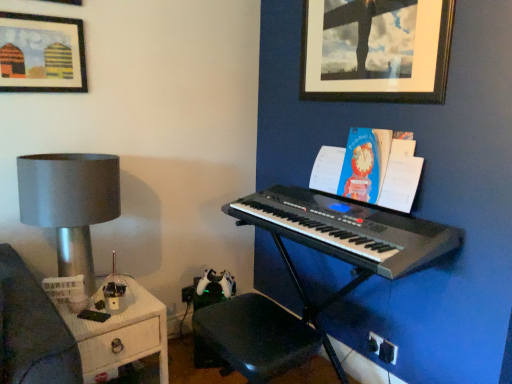
Locate an element on the screen. The width and height of the screenshot is (512, 384). blue paper book at upper right is located at coordinates (370, 169).

The height and width of the screenshot is (384, 512). What do you see at coordinates (370, 169) in the screenshot?
I see `blue paper book at upper right` at bounding box center [370, 169].

Describe the element at coordinates (376, 50) in the screenshot. Image resolution: width=512 pixels, height=384 pixels. I see `black matte picture frame at upper right, the 2th picture frame positioned from the left` at that location.

The height and width of the screenshot is (384, 512). Describe the element at coordinates (120, 332) in the screenshot. I see `white wood side table at lower left` at that location.

Measure the distance between matte silver lamp at left and camera.

A distance of 1.50 meters exists between matte silver lamp at left and camera.

Where is `matte silver lamp at left`? matte silver lamp at left is located at coordinates (70, 203).

Describe the element at coordinates (41, 54) in the screenshot. I see `matte wood picture frame at upper left, which ranks as the first picture frame in left-to-right order` at that location.

The width and height of the screenshot is (512, 384). What are the coordinates of `blue paper book at upper right` in the screenshot? It's located at (370, 169).

Does black plastic music stool at lower center appear on the right side of matte silver lamp at left?

Yes, black plastic music stool at lower center is to the right of matte silver lamp at left.

How distant is black plastic music stool at lower center from matte silver lamp at left?

26.82 inches.

From the image's perspective, which object appears higher, black plastic music stool at lower center or matte silver lamp at left?

matte silver lamp at left.

Choose the correct answer: Is matte wood picture frame at upper left, arranged as the 2th picture frame when viewed from the right, inside blue paper book at upper right or outside it?

matte wood picture frame at upper left, arranged as the 2th picture frame when viewed from the right, exists outside the volume of blue paper book at upper right.

In the scene shown: Which of these two, matte wood picture frame at upper left, arranged as the 2th picture frame when viewed from the right, or blue paper book at upper right, stands shorter?

With less height is matte wood picture frame at upper left, arranged as the 2th picture frame when viewed from the right.

Is matte wood picture frame at upper left, which ranks as the first picture frame in left-to-right order, not near blue paper book at upper right?

Yes, matte wood picture frame at upper left, which ranks as the first picture frame in left-to-right order, and blue paper book at upper right are located far from each other.

Can you confirm if matte wood picture frame at upper left, which ranks as the first picture frame in left-to-right order, is smaller than blue paper book at upper right?

Yes, matte wood picture frame at upper left, which ranks as the first picture frame in left-to-right order, is smaller than blue paper book at upper right.

Which of these two, white wood side table at lower left or blue paper book at upper right, stands taller?

white wood side table at lower left.

Does white wood side table at lower left have a larger size compared to blue paper book at upper right?

Indeed, white wood side table at lower left has a larger size compared to blue paper book at upper right.

Which point is more distant from viewer, [137,314] or [411,162]?

The point [411,162] is farther.

Is white wood side table at lower left inside or outside of blue paper book at upper right?

white wood side table at lower left is located beyond the bounds of blue paper book at upper right.

Is black plastic keyboard at center completely or partially inside black plastic music stool at lower center?

That's incorrect, black plastic keyboard at center is not inside black plastic music stool at lower center.

Between point (210, 325) and point (346, 237), which one is positioned behind?

Positioned behind is point (210, 325).

Consider the image. From a real-world perspective, is black plastic music stool at lower center above or below black plastic keyboard at center?

black plastic music stool at lower center is situated lower than black plastic keyboard at center in the real world.

From the picture: From the image's perspective, relative to black plastic keyboard at center, is white wood side table at lower left above or below?

Clearly, from the image's perspective, white wood side table at lower left is below black plastic keyboard at center.

Can you confirm if white wood side table at lower left is positioned to the left of black plastic keyboard at center?

Yes.

Does point (87, 372) come behind point (308, 297)?

That is False.

Are black plastic keyboard at center and white wood side table at lower left beside each other?

They are not placed beside each other.

Considering the relative positions of black plastic keyboard at center and white wood side table at lower left in the image provided, is black plastic keyboard at center to the left of white wood side table at lower left from the viewer's perspective?

In fact, black plastic keyboard at center is to the right of white wood side table at lower left.

From the image's perspective, relative to white wood side table at lower left, is black plastic keyboard at center above or below?

Clearly, from the image's perspective, black plastic keyboard at center is above white wood side table at lower left.

Is blue paper book at upper right positioned with its back to black plastic music stool at lower center?

No, blue paper book at upper right is not facing the opposite direction of black plastic music stool at lower center.

Is blue paper book at upper right placed right next to black plastic music stool at lower center?

No, blue paper book at upper right is not touching black plastic music stool at lower center.

Which of these two, blue paper book at upper right or black plastic music stool at lower center, is bigger?

black plastic music stool at lower center.

From the image's perspective, is blue paper book at upper right located above or below black plastic music stool at lower center?

Based on their image positions, blue paper book at upper right is located above black plastic music stool at lower center.

At what (x,y) coordinates should I click in order to perform the action: click on music stool on the right of matte silver lamp at left. Please return your answer as a coordinate pair (x, y). This screenshot has width=512, height=384. Looking at the image, I should click on [256, 336].

Find the location of a particular element. This screenshot has height=384, width=512. book that appears below the matte wood picture frame at upper left, arranged as the 2th picture frame when viewed from the right (from a real-world perspective) is located at coordinates (370, 169).

Which object lies nearer to the anchor point black plastic music stool at lower center, black plastic keyboard at center or matte wood picture frame at upper left, arranged as the 2th picture frame when viewed from the right?

black plastic keyboard at center is positioned closer to the anchor black plastic music stool at lower center.

Looking at the image, which one is located further to black plastic music stool at lower center, matte wood picture frame at upper left, arranged as the 2th picture frame when viewed from the right, or black plastic keyboard at center?

matte wood picture frame at upper left, arranged as the 2th picture frame when viewed from the right, lies further to black plastic music stool at lower center than the other object.

From the image, which object appears to be farther from blue paper book at upper right, white wood side table at lower left or black plastic music stool at lower center?

The object further to blue paper book at upper right is white wood side table at lower left.

Based on their spatial positions, is matte silver lamp at left or black matte picture frame at upper right, positioned as the 1th picture frame in right-to-left order, closer to blue paper book at upper right?

black matte picture frame at upper right, positioned as the 1th picture frame in right-to-left order.

Based on their spatial positions, is black plastic keyboard at center or black matte picture frame at upper right, positioned as the 1th picture frame in right-to-left order, further from matte wood picture frame at upper left, arranged as the 2th picture frame when viewed from the right?

Among the two, black matte picture frame at upper right, positioned as the 1th picture frame in right-to-left order, is located further to matte wood picture frame at upper left, arranged as the 2th picture frame when viewed from the right.

Looking at the image, which one is located closer to blue paper book at upper right, matte silver lamp at left or matte wood picture frame at upper left, which ranks as the first picture frame in left-to-right order?

The object closer to blue paper book at upper right is matte silver lamp at left.

Which object lies nearer to the anchor point black matte picture frame at upper right, positioned as the 1th picture frame in right-to-left order, matte wood picture frame at upper left, arranged as the 2th picture frame when viewed from the right, or black plastic keyboard at center?

The object closer to black matte picture frame at upper right, positioned as the 1th picture frame in right-to-left order, is black plastic keyboard at center.

Considering their positions, is white wood side table at lower left positioned further to black plastic keyboard at center than matte wood picture frame at upper left, arranged as the 2th picture frame when viewed from the right?

Based on the image, matte wood picture frame at upper left, arranged as the 2th picture frame when viewed from the right, appears to be further to black plastic keyboard at center.

This screenshot has height=384, width=512. What are the coordinates of `music stool between white wood side table at lower left and black plastic keyboard at center in the horizontal direction` in the screenshot? It's located at (256, 336).

This screenshot has height=384, width=512. I want to click on picture frame between black matte picture frame at upper right, the 2th picture frame positioned from the left, and black plastic music stool at lower center in the up-down direction, so click(x=41, y=54).

The width and height of the screenshot is (512, 384). What are the coordinates of `musical keyboard between matte wood picture frame at upper left, arranged as the 2th picture frame when viewed from the right, and black matte picture frame at upper right, the 2th picture frame positioned from the left, from left to right` in the screenshot? It's located at (347, 229).

This screenshot has width=512, height=384. In order to click on table lamp located between matte wood picture frame at upper left, which ranks as the first picture frame in left-to-right order, and black plastic keyboard at center in the left-right direction in this screenshot , I will do `click(70, 203)`.